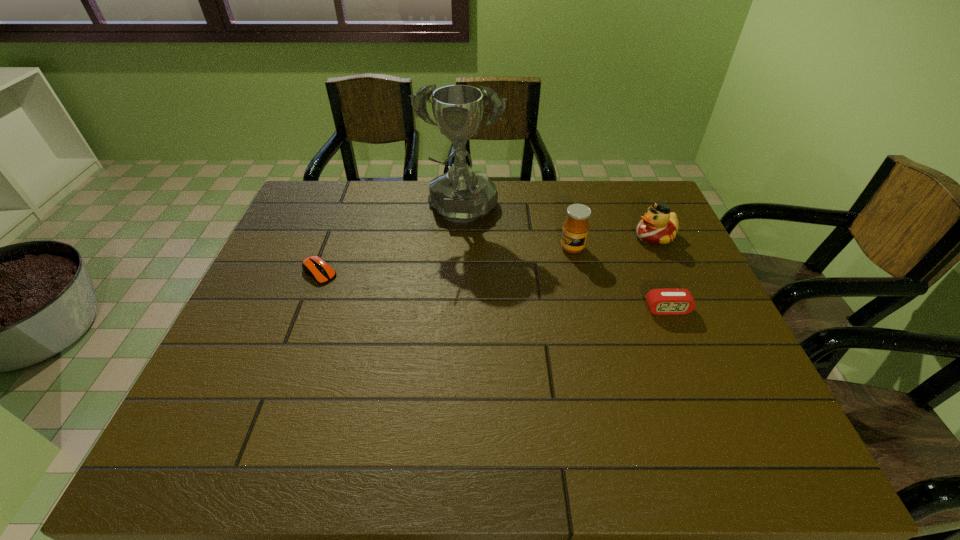
Find the location of a particular element. This screenshot has width=960, height=540. the second nearest object is located at coordinates (316, 267).

Locate an element on the screen. This screenshot has width=960, height=540. computer mouse is located at coordinates (316, 267).

At what (x,y) coordinates should I click in order to perform the action: click on the second shortest object. Please return your answer as a coordinate pair (x, y). Image resolution: width=960 pixels, height=540 pixels. Looking at the image, I should click on (670, 301).

The height and width of the screenshot is (540, 960). I want to click on the nearest object, so click(670, 301).

Locate an element on the screen. honey is located at coordinates (575, 230).

Locate an element on the screen. the fourth object from right to left is located at coordinates (460, 195).

This screenshot has width=960, height=540. I want to click on the tallest object, so click(460, 195).

The height and width of the screenshot is (540, 960). I want to click on duck, so click(658, 226).

Locate an element on the screen. free region located 0.180m on the front of the leftmost object is located at coordinates (294, 339).

Where is `vacant space situated 0.180m on the front-facing side of the alarm clock`? Image resolution: width=960 pixels, height=540 pixels. vacant space situated 0.180m on the front-facing side of the alarm clock is located at coordinates (695, 377).